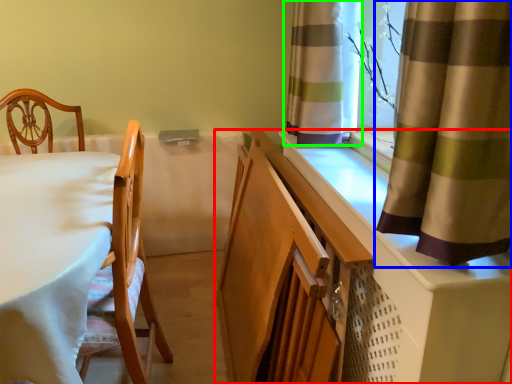
Question: Which object is positioned closest to cabinetry (highlighted by a red box)? Select from curtain (highlighted by a blue box) and curtain (highlighted by a green box).

Choices:
 (A) curtain
 (B) curtain

Answer: (A)